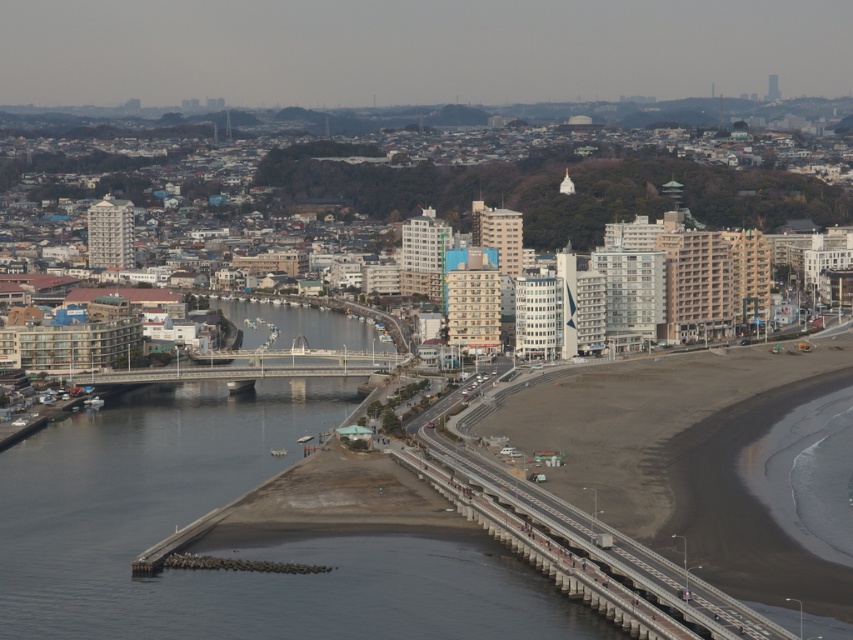
Which is more to the left, concrete bridge at lower center or concrete gray bridge at center?

From the viewer's perspective, concrete gray bridge at center appears more on the left side.

Is the position of concrete bridge at lower center more distant than that of concrete gray bridge at center?

Yes, concrete bridge at lower center is further from the viewer.

Which is in front, point (645, 636) or point (265, 362)?

Positioned in front is point (265, 362).

Locate an element on the screen. The height and width of the screenshot is (640, 853). concrete bridge at lower center is located at coordinates (554, 557).

Does concrete bridge at lower center appear under smooth concrete bridge at center?

Indeed, concrete bridge at lower center is positioned under smooth concrete bridge at center.

Is concrete bridge at lower center positioned before smooth concrete bridge at center?

Yes.

Where is `concrete bridge at lower center`? This screenshot has width=853, height=640. concrete bridge at lower center is located at coordinates click(554, 557).

What are the coordinates of `concrete bridge at lower center` in the screenshot? It's located at (554, 557).

Can you confirm if concrete gray bridge at center is taller than smooth concrete bridge at center?

No.

Is point (183, 369) more distant than point (335, 324)?

Yes, it is.

I want to click on concrete gray bridge at center, so click(x=256, y=365).